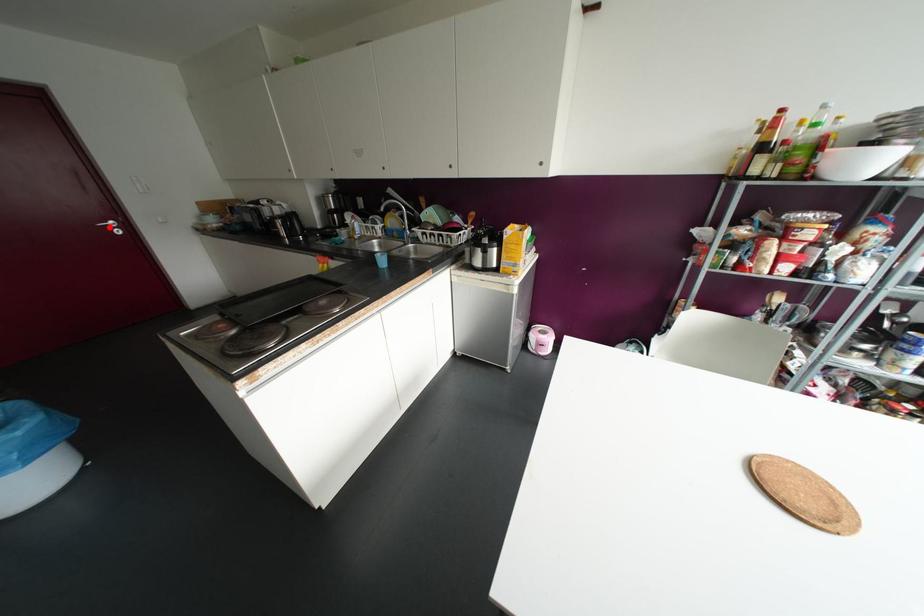
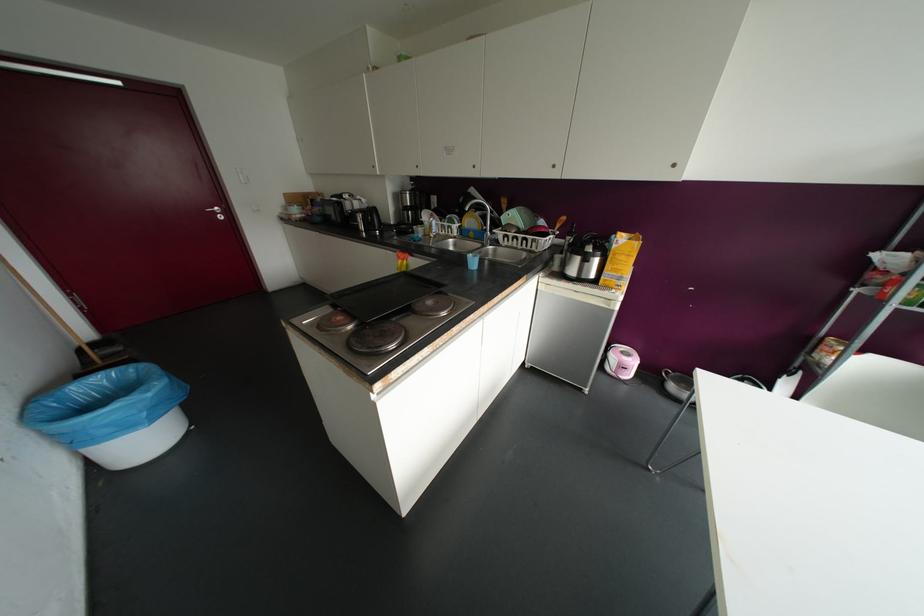
Find the pixel in the second image that matches the highlighted location in the first image.

(214, 213)